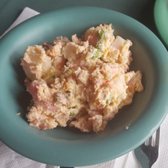
What are the coordinates of `fork` in the screenshot? It's located at (146, 153).